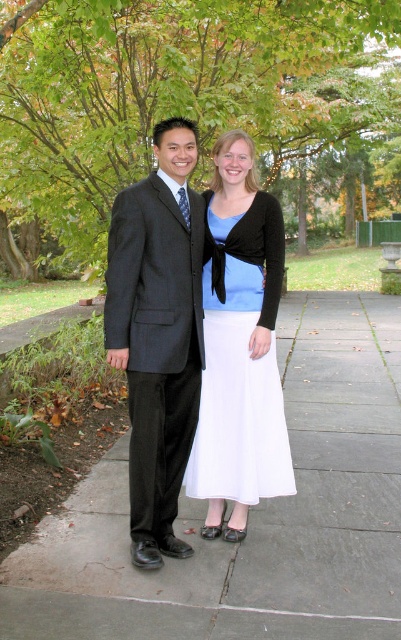
Does point (390, 68) come closer to viewer compared to point (64, 628)?

No, (390, 68) is behind (64, 628).

Is green leafy tree at upper center to the left of gray concrete pavement at center from the viewer's perspective?

In fact, green leafy tree at upper center is to the right of gray concrete pavement at center.

Who is more forward, (24, 29) or (141, 632)?

Point (141, 632)

Locate an element on the screen. The image size is (401, 640). green leafy tree at upper center is located at coordinates (194, 102).

Who is lower down, dark gray pinstripe suit at center or white satin dress at center?

dark gray pinstripe suit at center

Does dark gray pinstripe suit at center come in front of white satin dress at center?

Yes, dark gray pinstripe suit at center is closer to the viewer.

The height and width of the screenshot is (640, 401). What do you see at coordinates (157, 340) in the screenshot? I see `dark gray pinstripe suit at center` at bounding box center [157, 340].

Where is `dark gray pinstripe suit at center`? The width and height of the screenshot is (401, 640). dark gray pinstripe suit at center is located at coordinates (157, 340).

Which is above, green leafy tree at upper center or white satin dress at center?

green leafy tree at upper center is higher up.

In the scene shown: Is green leafy tree at upper center wider than white satin dress at center?

Yes, green leafy tree at upper center is wider than white satin dress at center.

Which is in front, point (24, 173) or point (204, 356)?

Point (204, 356) is more forward.

Identify the location of green leafy tree at upper center. The image size is (401, 640). (194, 102).